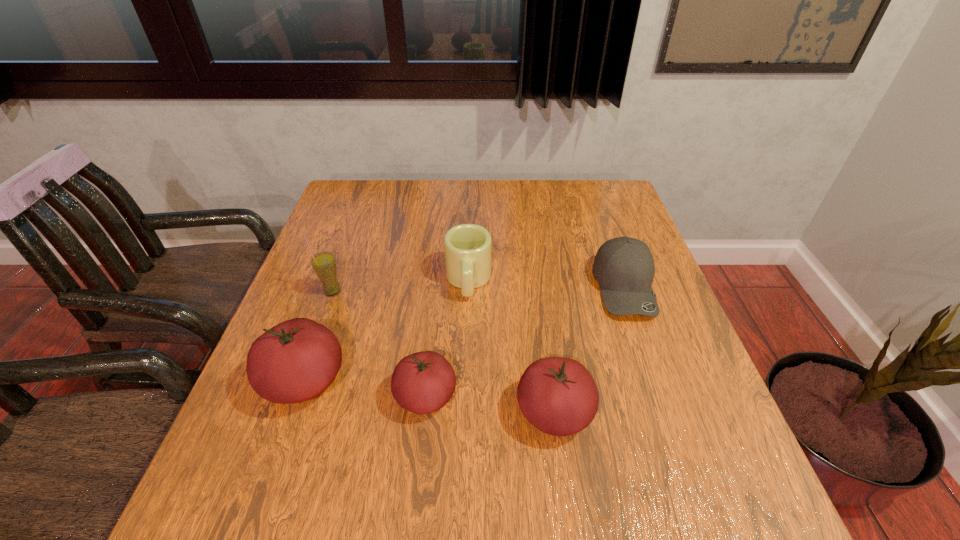
Identify the location of free space between the second object from right to left and the mug. The image size is (960, 540). pyautogui.click(x=512, y=347).

You are a GUI agent. You are given a task and a screenshot of the screen. Output one action in this format:
    pyautogui.click(x=<x>, y=<y>)
    Task: Click on the free spot between the rightmost tomato and the mug
    The image size is (960, 540).
    Given the screenshot: What is the action you would take?
    pyautogui.click(x=512, y=347)

Locate which object is the second closest to the leftmost tomato. Please provide its 2D coordinates. Your answer should be formatted as a tuple, i.e. [(x, y)], where the tuple contains the x and y coordinates of a point satisfying the conditions above.

[(324, 264)]

Identify which object is the closest to the mug. Please provide its 2D coordinates. Your answer should be formatted as a tuple, i.e. [(x, y)], where the tuple contains the x and y coordinates of a point satisfying the conditions above.

[(423, 382)]

Identify which tomato is the third nearest to the straw for drinking. Please provide its 2D coordinates. Your answer should be formatted as a tuple, i.e. [(x, y)], where the tuple contains the x and y coordinates of a point satisfying the conditions above.

[(557, 395)]

This screenshot has width=960, height=540. I want to click on the second closest tomato to the baseball cap, so click(423, 382).